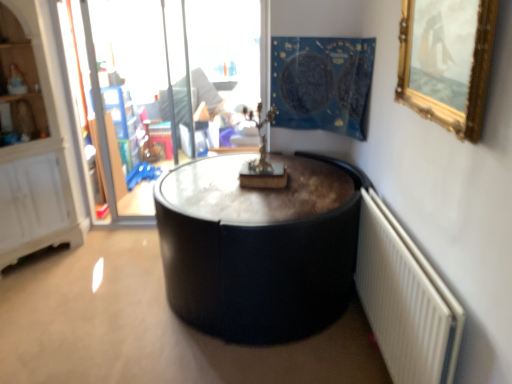
Question: Does transparent glass door at upper left have a greater width compared to white textured radiator at lower right?

Choices:
 (A) no
 (B) yes

Answer: (B)

Question: Considering the relative positions of transparent glass door at upper left and white textured radiator at lower right in the image provided, is transparent glass door at upper left behind white textured radiator at lower right?

Choices:
 (A) yes
 (B) no

Answer: (A)

Question: Considering the relative positions of transparent glass door at upper left and white textured radiator at lower right in the image provided, is transparent glass door at upper left to the right of white textured radiator at lower right from the viewer's perspective?

Choices:
 (A) no
 (B) yes

Answer: (A)

Question: Does transparent glass door at upper left come in front of white textured radiator at lower right?

Choices:
 (A) no
 (B) yes

Answer: (A)

Question: Considering the relative positions of transparent glass door at upper left and white textured radiator at lower right in the image provided, is transparent glass door at upper left to the left of white textured radiator at lower right from the viewer's perspective?

Choices:
 (A) yes
 (B) no

Answer: (A)

Question: Considering the positions of transparent glass door at upper left and gold-framed mirror at upper right in the image, is transparent glass door at upper left wider or thinner than gold-framed mirror at upper right?

Choices:
 (A) thin
 (B) wide

Answer: (B)

Question: Is transparent glass door at upper left inside or outside of gold-framed mirror at upper right?

Choices:
 (A) outside
 (B) inside

Answer: (A)

Question: Considering the positions of transparent glass door at upper left and gold-framed mirror at upper right in the image, is transparent glass door at upper left taller or shorter than gold-framed mirror at upper right?

Choices:
 (A) tall
 (B) short

Answer: (A)

Question: Is point (138, 46) positioned closer to the camera than point (458, 21)?

Choices:
 (A) farther
 (B) closer

Answer: (A)

Question: Considering the positions of point [x=387, y=365] and point [x=302, y=117], is point [x=387, y=365] closer or farther from the camera than point [x=302, y=117]?

Choices:
 (A) farther
 (B) closer

Answer: (B)

Question: Is white textured radiator at lower right bigger or smaller than blue fabric tapestry at upper center?

Choices:
 (A) big
 (B) small

Answer: (B)

Question: Considering the positions of white textured radiator at lower right and blue fabric tapestry at upper center in the image, is white textured radiator at lower right taller or shorter than blue fabric tapestry at upper center?

Choices:
 (A) short
 (B) tall

Answer: (B)

Question: Would you say white textured radiator at lower right is to the left or to the right of blue fabric tapestry at upper center in the picture?

Choices:
 (A) right
 (B) left

Answer: (A)

Question: Do you think white textured radiator at lower right is within transparent glass door at upper left, or outside of it?

Choices:
 (A) outside
 (B) inside

Answer: (A)

Question: Would you say white textured radiator at lower right is to the left or to the right of transparent glass door at upper left in the picture?

Choices:
 (A) left
 (B) right

Answer: (B)